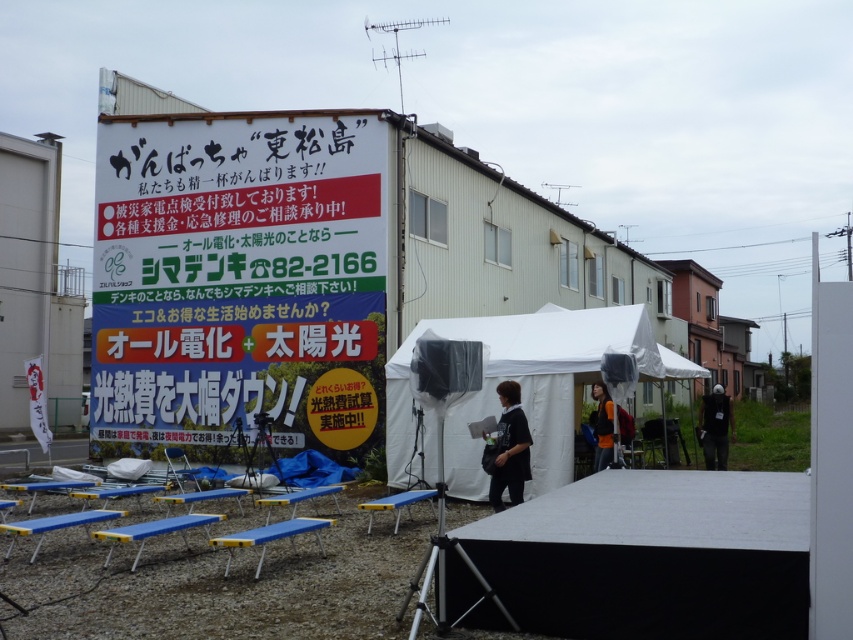
Does white fabric canopy at center have a greater width compared to orange fabric jacket at center?

Yes, white fabric canopy at center is wider than orange fabric jacket at center.

Is point (656, 352) positioned in front of point (596, 468)?

No, (656, 352) is behind (596, 468).

Locate an element on the screen. Image resolution: width=853 pixels, height=640 pixels. white fabric canopy at center is located at coordinates click(523, 385).

Does white paperboard sign at upper center appear on the left side of dark gray fabric bag at center?

Yes, white paperboard sign at upper center is to the left of dark gray fabric bag at center.

Which is above, white paperboard sign at upper center or dark gray fabric bag at center?

white paperboard sign at upper center is above.

Which is behind, point (154, 435) or point (503, 420)?

The point (154, 435) is more distant.

You are a GUI agent. You are given a task and a screenshot of the screen. Output one action in this format:
    pyautogui.click(x=<x>, y=<y>)
    Task: Click on the white paperboard sign at upper center
    This screenshot has width=853, height=640.
    Given the screenshot: What is the action you would take?
    pyautogui.click(x=238, y=276)

Can you confirm if dark gray fabric bag at center is positioned above dark green fabric jacket at lower right?

Correct, dark gray fabric bag at center is located above dark green fabric jacket at lower right.

Based on the photo, who is shorter, dark gray fabric bag at center or dark green fabric jacket at lower right?

dark gray fabric bag at center

Is point (514, 449) positioned in front of point (705, 433)?

Yes, it is in front of point (705, 433).

Find the location of a particular element. dark gray fabric bag at center is located at coordinates (509, 449).